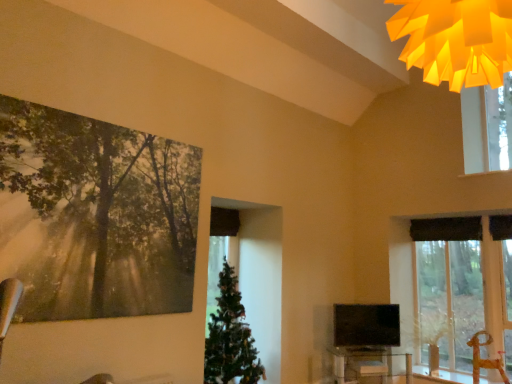
Question: Is matte black tv at center inside the boundaries of green matte christmas tree at center, or outside?

Choices:
 (A) inside
 (B) outside

Answer: (B)

Question: From the image's perspective, relative to green matte christmas tree at center, is matte black tv at center above or below?

Choices:
 (A) below
 (B) above

Answer: (A)

Question: Considering the real-world distances, which object is closest to the green matte christmas tree at center?

Choices:
 (A) clear glass table at lower center
 (B) matte black tv at center
 (C) metallic silver swivel chair at lower right
 (D) black textured curtain at upper center
 (E) matte forest painting at upper left

Answer: (B)

Question: Which is farther from the black textured curtain at upper center?

Choices:
 (A) metallic silver swivel chair at lower right
 (B) matte forest painting at upper left
 (C) clear glass table at lower center
 (D) green matte christmas tree at center
 (E) matte black tv at center

Answer: (B)